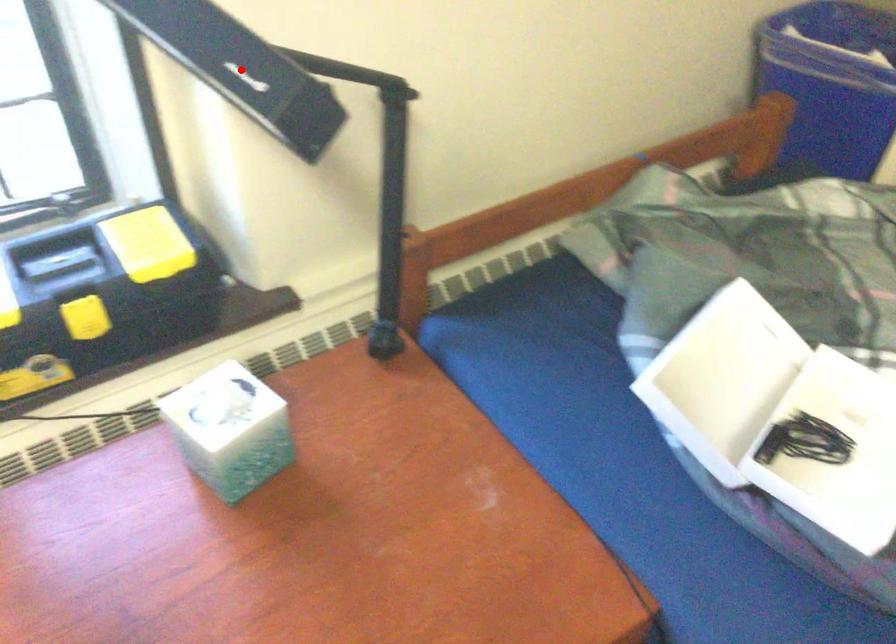
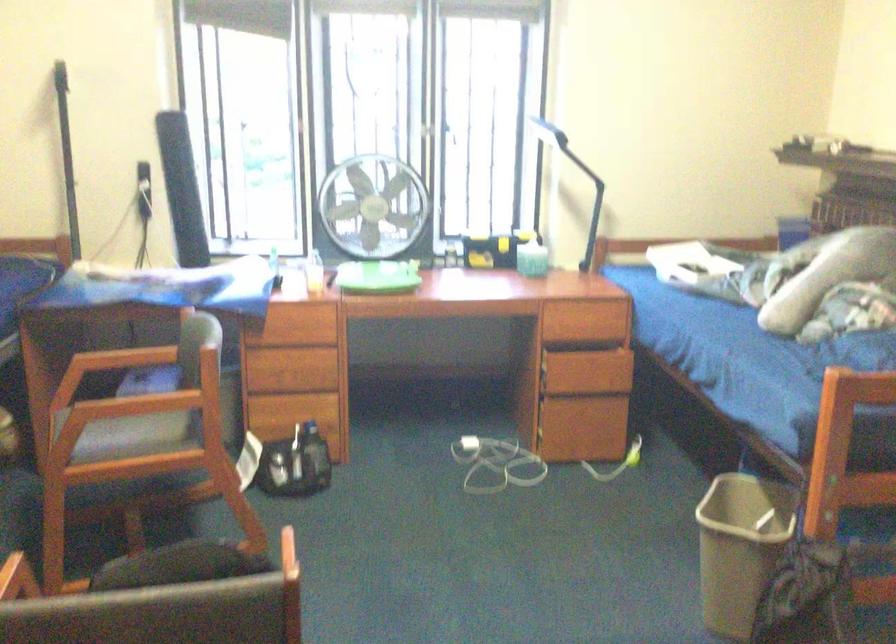
Question: I am providing you with two images of the same scene from different viewpoints. A red point is marked on the first image. Is the red point's position out of view in image 2?

Choices:
 (A) Yes
 (B) No

Answer: (A)